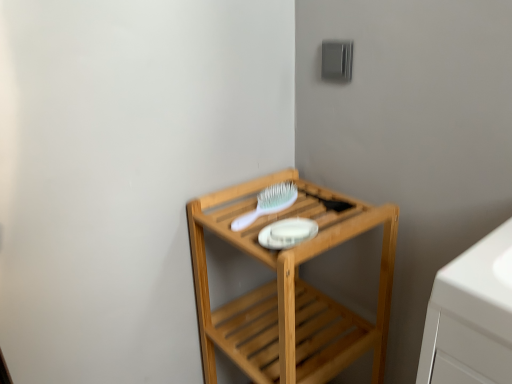
You are a GUI agent. You are given a task and a screenshot of the screen. Output one action in this format:
    pyautogui.click(x=<x>, y=<y>)
    Task: Click on the vacant space in front of white plastic brush at upper center
    This screenshot has width=512, height=384.
    Given the screenshot: What is the action you would take?
    pyautogui.click(x=268, y=232)